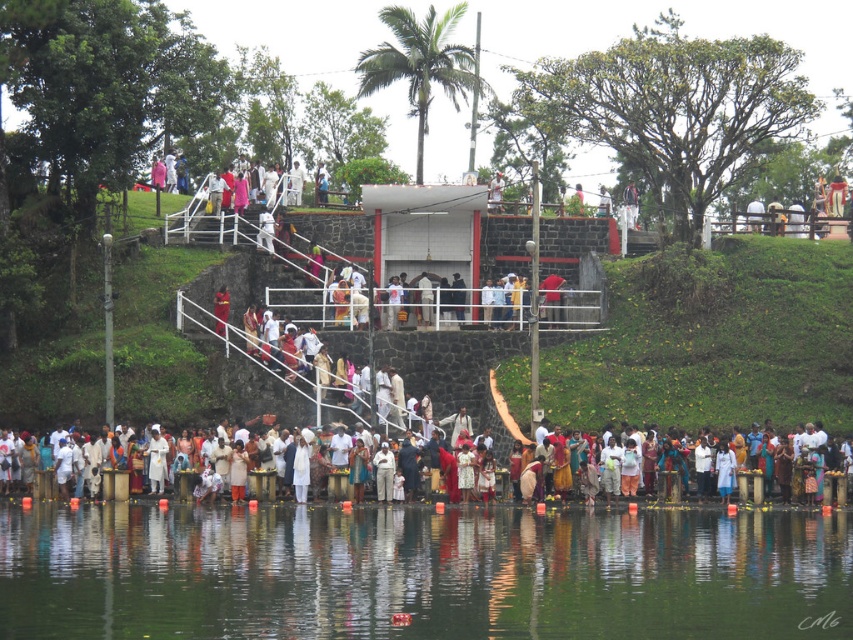
You are standing at the point marked as point (421, 572) in the image. What is located at that exact point?

Transparent water at lower center is located at point (421, 572).

You are standing at the edge of the lake in the scene. You see a point marked at coordinates (x=827, y=476). What is located at that point?

The point at coordinates (x=827, y=476) marks white clothed people at lower center.

You are a photographer standing at the edge of the lake and want to capture both the white clothed people at lower center and the red fabric cloth at center in the same frame. Which object should be placed to the right side in your photo?

The white clothed people at lower center should be placed to the right side in your photo because they are positioned on the right side of the red fabric cloth at center according to the description.